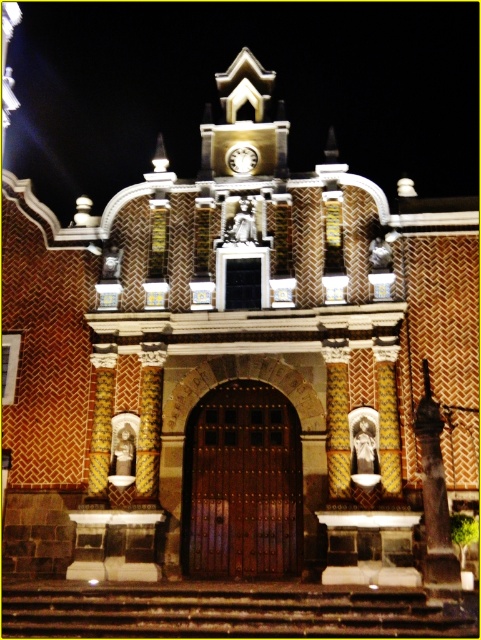
Can you confirm if brick building at center is taller than dark brown stone statue at right?

Yes.

Can you confirm if brick building at center is thinner than dark brown stone statue at right?

Incorrect, brick building at center's width is not less than dark brown stone statue at right's.

Is point (443, 141) in front of point (419, 424)?

No, it is behind (419, 424).

The height and width of the screenshot is (640, 481). What are the coordinates of `brick building at center` in the screenshot? It's located at pos(216,93).

Is point (430, 570) behind point (243, 166)?

No, it is in front of (243, 166).

Between point (433, 483) and point (238, 166), which one is positioned in front?

Point (433, 483) is in front.

The image size is (481, 640). What do you see at coordinates (434, 496) in the screenshot?
I see `dark brown stone statue at right` at bounding box center [434, 496].

Find the location of `dark brown stone statue at right`. dark brown stone statue at right is located at coordinates (434, 496).

Can you confirm if brick building at center is positioned below metallic clock face at center?

No, brick building at center is not below metallic clock face at center.

Who is higher up, brick building at center or metallic clock face at center?

Positioned higher is brick building at center.

Who is more forward, (179, 141) or (237, 168)?

Point (237, 168) is more forward.

At what (x,y) coordinates should I click in order to perform the action: click on brick building at center. Please return your answer as a coordinate pair (x, y). The image size is (481, 640). Looking at the image, I should click on (216, 93).